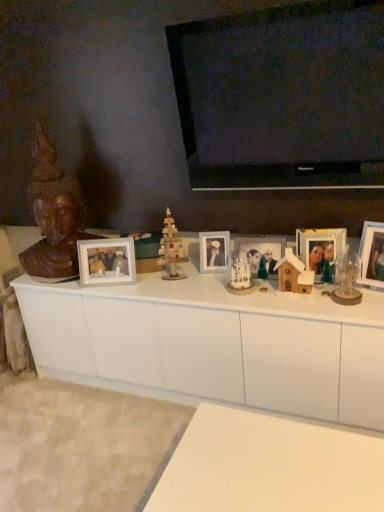
Question: Does matte wooden picture frame at center, which ranks as the 3th picture frame in left-to-right order, appear on the right side of white ceramic snowman at center, which is the 2th toy in left-to-right order?

Choices:
 (A) no
 (B) yes

Answer: (B)

Question: Is matte wooden picture frame at center, acting as the third picture frame starting from the right, not close to white ceramic snowman at center, which is the 2th toy in left-to-right order?

Choices:
 (A) no
 (B) yes

Answer: (A)

Question: Considering the relative sizes of matte wooden picture frame at center, acting as the third picture frame starting from the right, and white ceramic snowman at center, which is the 2th toy in left-to-right order, in the image provided, is matte wooden picture frame at center, acting as the third picture frame starting from the right, taller than white ceramic snowman at center, which is the 2th toy in left-to-right order,?

Choices:
 (A) no
 (B) yes

Answer: (B)

Question: Is matte wooden picture frame at center, acting as the third picture frame starting from the right, thinner than white ceramic snowman at center, which is the 2th toy in left-to-right order?

Choices:
 (A) no
 (B) yes

Answer: (B)

Question: Does matte wooden picture frame at center, acting as the third picture frame starting from the right, turn towards white ceramic snowman at center, the 2th toy from the right?

Choices:
 (A) no
 (B) yes

Answer: (B)

Question: Does point (367, 473) appear closer or farther from the camera than point (132, 249)?

Choices:
 (A) farther
 (B) closer

Answer: (B)

Question: Would you say white matte table at lower center is to the left or to the right of white matte picture frame at center, marked as the fifth picture frame in a right-to-left arrangement, in the picture?

Choices:
 (A) left
 (B) right

Answer: (B)

Question: Considering the positions of white matte table at lower center and white matte picture frame at center, marked as the fifth picture frame in a right-to-left arrangement, in the image, is white matte table at lower center bigger or smaller than white matte picture frame at center, marked as the fifth picture frame in a right-to-left arrangement,?

Choices:
 (A) big
 (B) small

Answer: (A)

Question: In the image, is white matte table at lower center positioned in front of or behind white matte picture frame at center, placed as the 1th picture frame when sorted from left to right?

Choices:
 (A) behind
 (B) front

Answer: (B)

Question: Based on their positions, is matte glass photo frame at center, positioned as the 2th picture frame in left-to-right order, located to the left or right of wooden statue at left?

Choices:
 (A) left
 (B) right

Answer: (B)

Question: From the image's perspective, relative to wooden statue at left, is matte glass photo frame at center, positioned as the 2th picture frame in left-to-right order, above or below?

Choices:
 (A) above
 (B) below

Answer: (B)

Question: In terms of width, does matte glass photo frame at center, the 4th picture frame from the right, look wider or thinner when compared to wooden statue at left?

Choices:
 (A) thin
 (B) wide

Answer: (A)

Question: From a real-world perspective, is matte glass photo frame at center, positioned as the 2th picture frame in left-to-right order, physically located above or below wooden statue at left?

Choices:
 (A) above
 (B) below

Answer: (B)

Question: Is white ceramic snowman at center, which is the 2th toy in left-to-right order, in front of or behind white matte picture frame at center, marked as the fifth picture frame in a right-to-left arrangement, in the image?

Choices:
 (A) behind
 (B) front

Answer: (B)

Question: Looking at their shapes, would you say white ceramic snowman at center, which is the 2th toy in left-to-right order, is wider or thinner than white matte picture frame at center, placed as the 1th picture frame when sorted from left to right?

Choices:
 (A) thin
 (B) wide

Answer: (B)